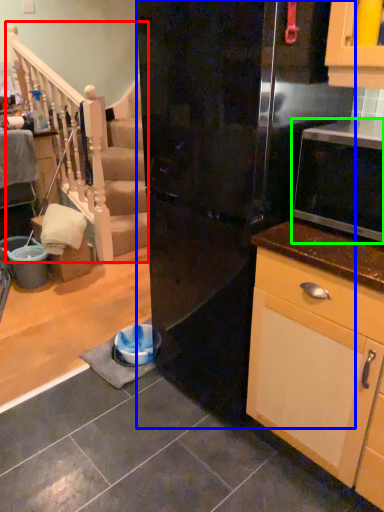
Question: Which is nearer to the rail (highlighted by a red box)? refrigerator (highlighted by a blue box) or microwave oven (highlighted by a green box).

Choices:
 (A) refrigerator
 (B) microwave oven

Answer: (A)